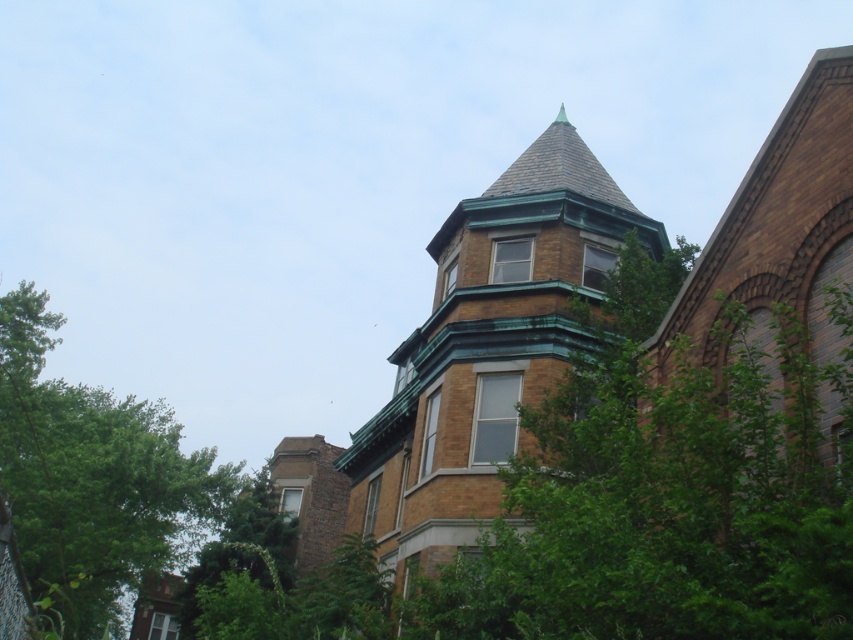
Question: Which object is closer to the camera taking this photo?

Choices:
 (A) green leafy tree at left
 (B) brown brick tower at center

Answer: (B)

Question: Which of the following is the farthest from the observer?

Choices:
 (A) (567, 308)
 (B) (24, 481)

Answer: (B)

Question: In this image, where is brown brick tower at center located relative to green leafy tree at left?

Choices:
 (A) left
 (B) right

Answer: (B)

Question: Does brown brick tower at center have a larger size compared to green leafy tree at left?

Choices:
 (A) yes
 (B) no

Answer: (B)

Question: Which object appears closest to the camera in this image?

Choices:
 (A) brown brick tower at center
 (B) green leafy tree at left

Answer: (A)

Question: Does brown brick tower at center have a larger size compared to green leafy tree at left?

Choices:
 (A) yes
 (B) no

Answer: (B)